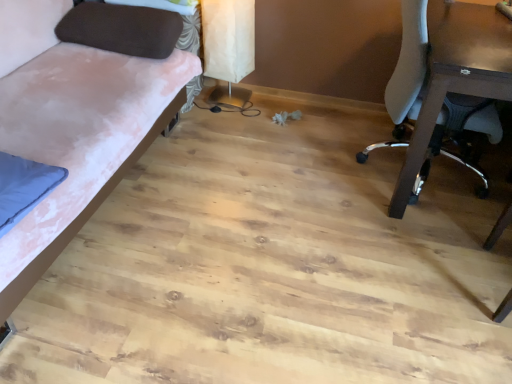
Image resolution: width=512 pixels, height=384 pixels. In order to click on unoccupied area in front of white paper lampshade at upper center in this screenshot , I will do `click(220, 120)`.